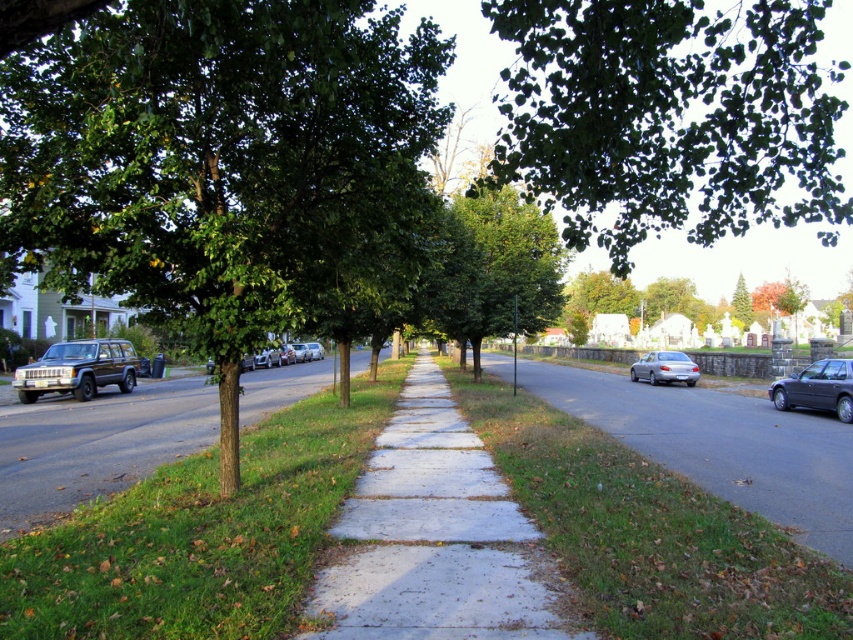
You are a pedestrian standing on the sidewalk and want to walk towards the cemetery. You notice two green leafy trees ahead. Which tree should you walk around to stay on the sidewalk? The green leafy tree at upper center or the green leafy tree at center?

You should walk around the green leafy tree at center because the green leafy tree at upper center is to the right of it, so the tree at center is closer to your path towards the cemetery.

You are a delivery person with a 3.5 feet wide cart. You need to move from the gray asphalt sidewalk at center to the smooth asphalt road at left. Is there enough space between them for your cart to pass through?

The distance between the gray asphalt sidewalk at center and the smooth asphalt road at left is 43.19 feet, which is more than enough space for a 3.5 feet wide cart to pass through.

You are a delivery person needing to drive a 2.5 meter wide truck through the street. The truck requires a path at least 3 meters wide to safely navigate. Looking at the scene, which area between the concrete at center and the smooth asphalt road at left should you choose?

Result: The smooth asphalt road at left is wider than the concrete at center. Since the truck requires 3 meters, you should choose the smooth asphalt road at left if it meets the width requirement. However, since the concrete at center is narrower, it might not be suitable.